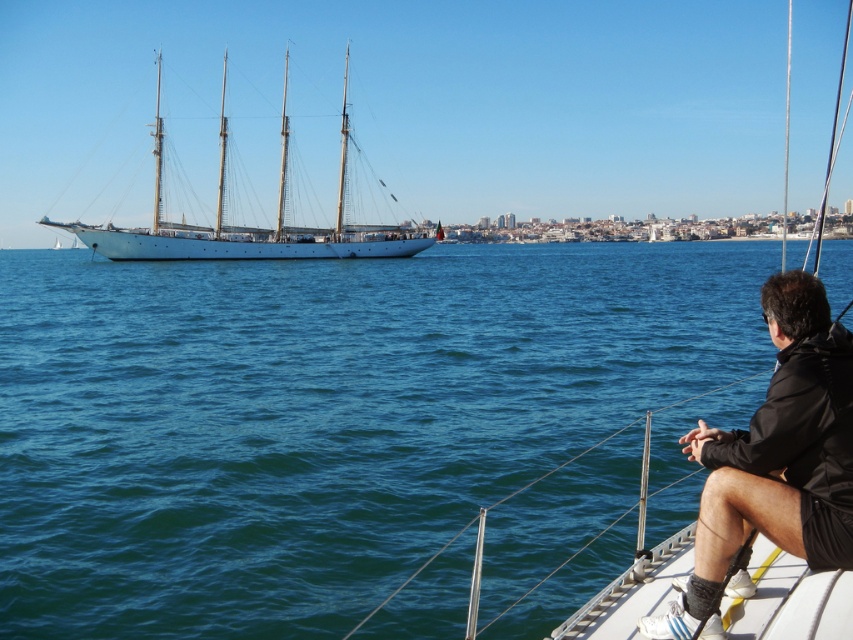
Question: Estimate the real-world distances between objects in this image. Which object is farther from the blue water at left?

Choices:
 (A) black matte jacket at lower right
 (B) white matte sailboat at left
 (C) white polished wood sailboat at left

Answer: (A)

Question: Considering the real-world distances, which object is closest to the white matte sailboat at left?

Choices:
 (A) black matte jacket at lower right
 (B) white polished wood sailboat at left

Answer: (A)

Question: Does blue water at left have a smaller size compared to black matte jacket at lower right?

Choices:
 (A) no
 (B) yes

Answer: (A)

Question: Is blue water at left to the right of black matte jacket at lower right from the viewer's perspective?

Choices:
 (A) no
 (B) yes

Answer: (B)

Question: Can you confirm if black matte jacket at lower right is bigger than white polished wood sailboat at left?

Choices:
 (A) yes
 (B) no

Answer: (B)

Question: Which object is farther from the camera taking this photo?

Choices:
 (A) white matte sailboat at left
 (B) blue water at left

Answer: (B)